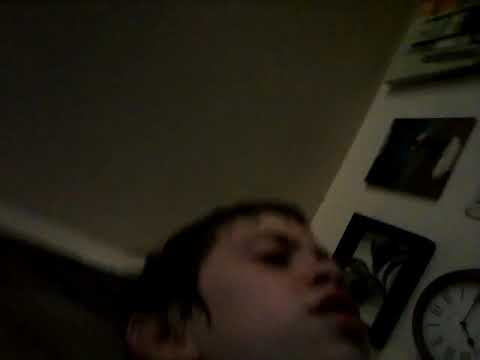
Where is `ceiling`? ceiling is located at coordinates point(197,158).